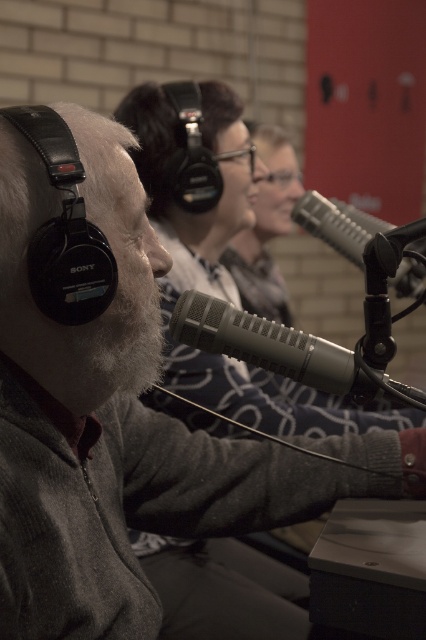
You are a sound engineer in a recording studio. You need to adjust the position of the matte black microphone at center and the silver metallic microphone at center. According to the scene, which microphone is positioned lower?

The matte black microphone at center is located below the silver metallic microphone at center, so it is positioned lower.

You are a sound engineer in the studio and need to adjust the settings for both the matte black microphone at center and the silver metallic microphone at center. Which microphone should you reach for first if you want to adjust the one that is closer to you?

The matte black microphone at center is closer to the viewer than the silver metallic microphone at center, so you should reach for the matte black microphone at center first.

You are a sound engineer in a radio studio. You need to choose a microphone that is smaller in size between the matte black microphone at center and the silver metallic microphone at center. Which one should you select?

The matte black microphone at center has a smaller size compared to the silver metallic microphone at center, so you should select the matte black microphone at center.